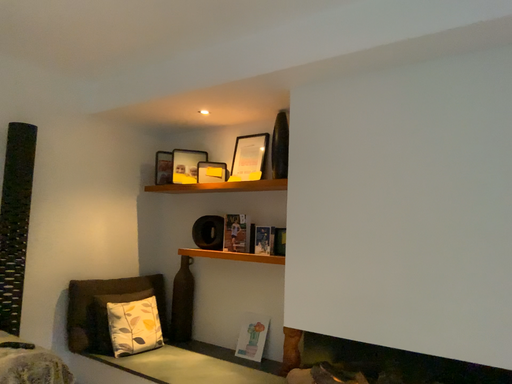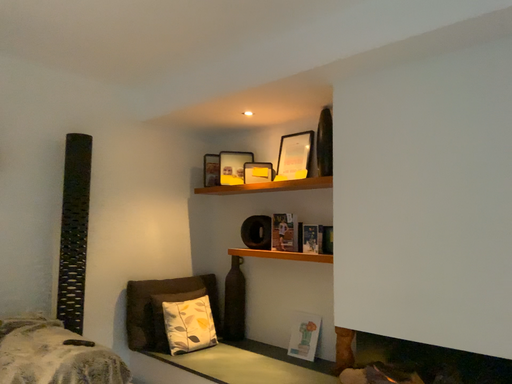
Question: How did the camera likely rotate when shooting the video?

Choices:
 (A) rotated left
 (B) rotated right

Answer: (A)